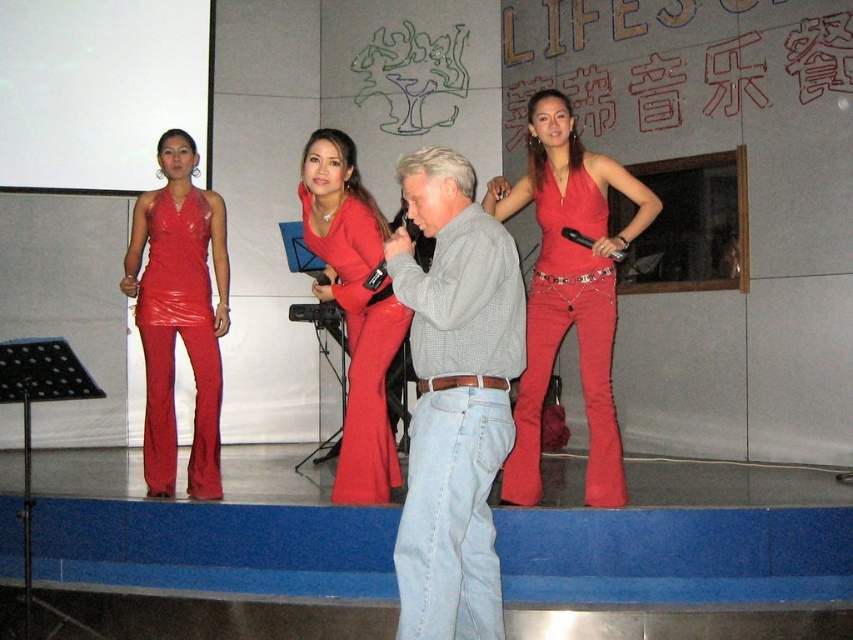
Based on the scene description, which object, the redtexturedwall at upper center or the matte red jumpsuit at center, has a greater height?

The matte red jumpsuit at center has a greater height than the redtexturedwall at upper center according to the description.

You are a photographer trying to capture the performer in the shiny red dress at center. You notice a point at coordinates [563,336] on your camera screen. Based on the scene description, can you confirm if this point is part of the shiny red dress at center?

Yes, the point at coordinates [563,336] is part of the shiny red dress at center, as the Objects Description states that the point is on the shiny red dress at center.

You are a photographer taking a picture of the stage performance. You notice two points on the stage marked as point (730,600) and point (515,452). Which point should you focus on to ensure it appears closer in the photo?

Point (730,600) is closer to the camera than point (515,452), so focusing on point (730,600) will make it appear closer in the photo.